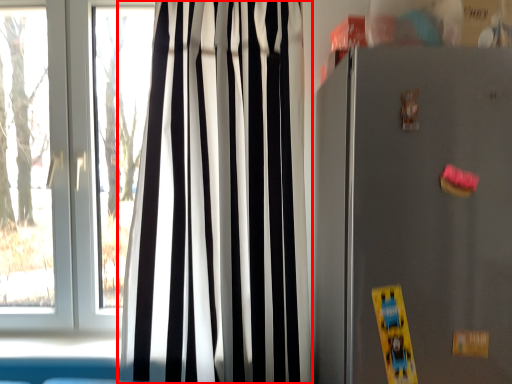
Question: Observing the image, what is the correct spatial positioning of curtain (annotated by the red box) in reference to appliance?

Choices:
 (A) left
 (B) right

Answer: (A)